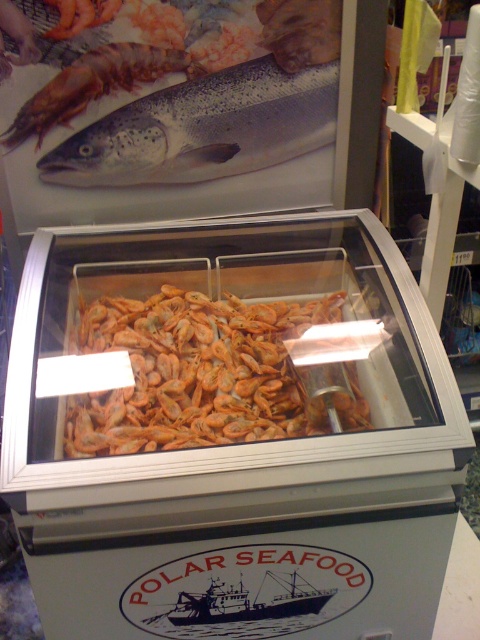
Question: Which point is closer to the camera taking this photo?

Choices:
 (A) (80, 60)
 (B) (55, 168)
 (C) (164, 378)

Answer: (C)

Question: Where is orange matte prawns at center located in relation to shiny orange prawn at upper left in the image?

Choices:
 (A) above
 (B) below

Answer: (B)

Question: Which of the following is the farthest from the observer?

Choices:
 (A) shiny silver fish at upper center
 (B) shiny orange prawn at upper left
 (C) orange matte prawns at center

Answer: (A)

Question: Does orange matte prawns at center lie in front of shiny silver fish at upper center?

Choices:
 (A) yes
 (B) no

Answer: (A)

Question: Is orange matte prawns at center to the right of shiny silver fish at upper center from the viewer's perspective?

Choices:
 (A) no
 (B) yes

Answer: (B)

Question: Which point is farther to the camera?

Choices:
 (A) (108, 61)
 (B) (216, 346)
 (C) (280, 72)

Answer: (C)